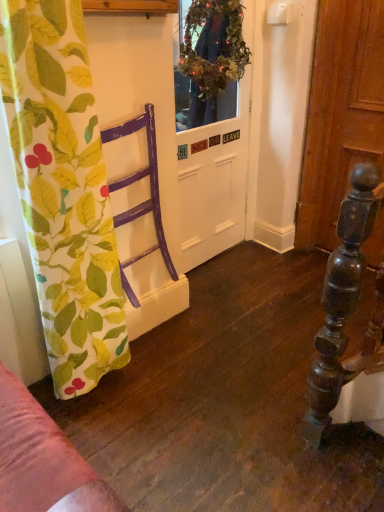
Question: Is green leafy wreath at upper center inside purple wood chair at left?

Choices:
 (A) yes
 (B) no

Answer: (B)

Question: Can you confirm if purple wood chair at left is taller than green leafy wreath at upper center?

Choices:
 (A) no
 (B) yes

Answer: (B)

Question: Can you confirm if purple wood chair at left is bigger than green leafy wreath at upper center?

Choices:
 (A) no
 (B) yes

Answer: (B)

Question: Does purple wood chair at left have a smaller size compared to green leafy wreath at upper center?

Choices:
 (A) yes
 (B) no

Answer: (B)

Question: Considering the relative positions of purple wood chair at left and green leafy wreath at upper center in the image provided, is purple wood chair at left to the right of green leafy wreath at upper center from the viewer's perspective?

Choices:
 (A) no
 (B) yes

Answer: (A)

Question: Is purple wood chair at left outside of green leafy wreath at upper center?

Choices:
 (A) no
 (B) yes

Answer: (B)

Question: From a real-world perspective, is printed fabric curtain at left physically below green leafy wreath at upper center?

Choices:
 (A) yes
 (B) no

Answer: (A)

Question: From the image's perspective, is printed fabric curtain at left located beneath green leafy wreath at upper center?

Choices:
 (A) no
 (B) yes

Answer: (B)

Question: Can you confirm if printed fabric curtain at left is bigger than green leafy wreath at upper center?

Choices:
 (A) yes
 (B) no

Answer: (A)

Question: Is printed fabric curtain at left thinner than green leafy wreath at upper center?

Choices:
 (A) yes
 (B) no

Answer: (B)

Question: Can you confirm if printed fabric curtain at left is shorter than green leafy wreath at upper center?

Choices:
 (A) yes
 (B) no

Answer: (B)

Question: Is printed fabric curtain at left positioned far away from green leafy wreath at upper center?

Choices:
 (A) no
 (B) yes

Answer: (B)

Question: Can you confirm if purple wood chair at left is wider than white matte door at center?

Choices:
 (A) no
 (B) yes

Answer: (B)